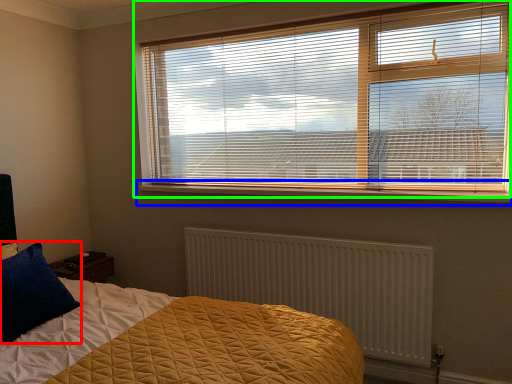
Question: Which object is positioned farthest from pillow (highlighted by a red box)? Select from window sill (highlighted by a blue box) and window blind (highlighted by a green box).

Choices:
 (A) window sill
 (B) window blind

Answer: (B)